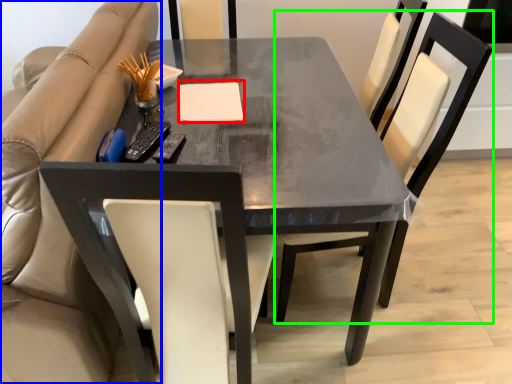
Question: Based on their relative distances, which object is nearer to notepad (highlighted by a red box)? Choose from beige (highlighted by a blue box) and chair (highlighted by a green box).

Choices:
 (A) beige
 (B) chair

Answer: (A)